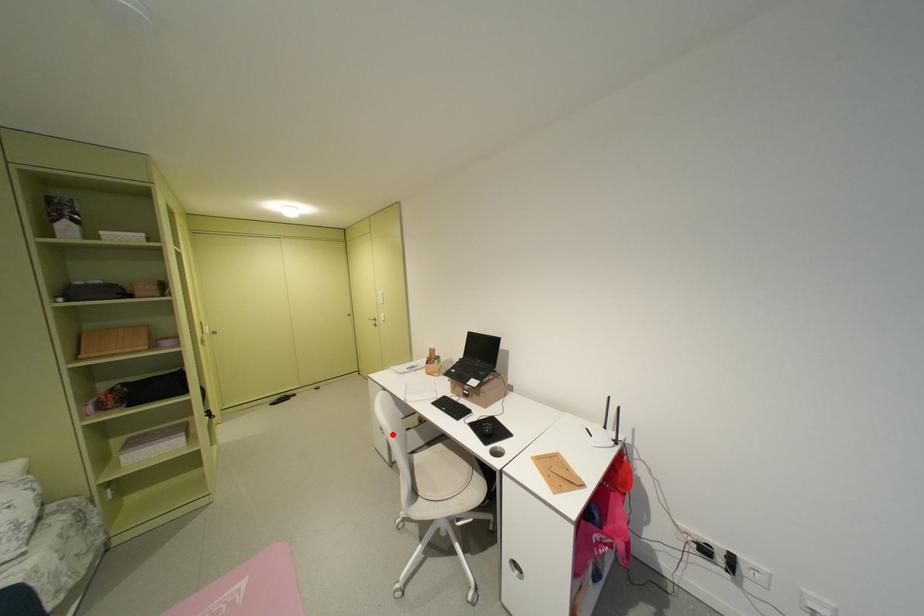
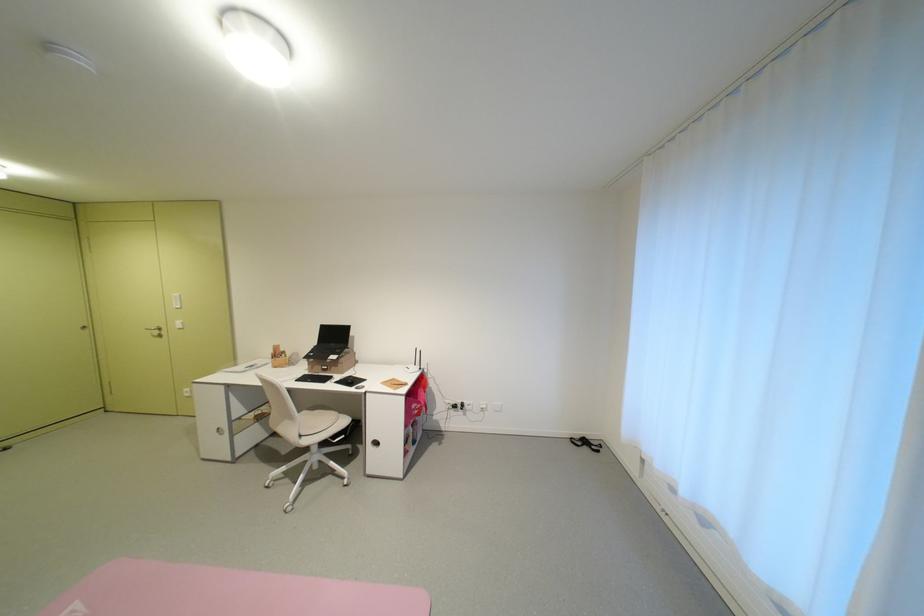
Question: A red point is marked in image1. In image2, is the corresponding 3D point closer to the camera or farther? Reply with the corresponding letter.

Choices:
 (A) The corresponding 3D point is closer.
 (B) The corresponding 3D point is farther.

Answer: (A)